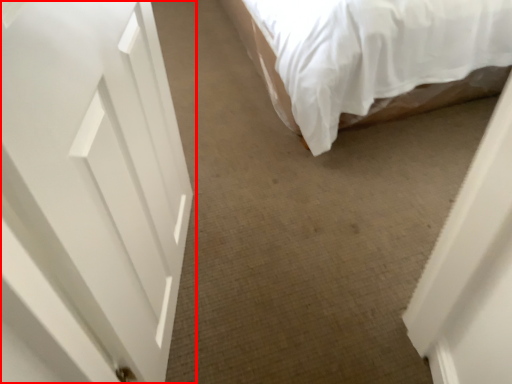
Question: From the image's perspective, where is door (annotated by the red box) located in relation to bed in the image?

Choices:
 (A) above
 (B) below

Answer: (B)